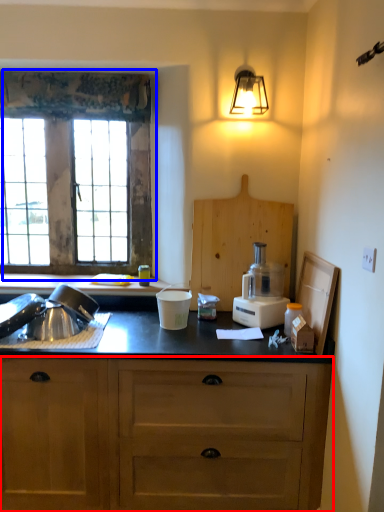
Question: Which object appears farthest to the camera in this image, cabinetry (highlighted by a red box) or window (highlighted by a blue box)?

Choices:
 (A) cabinetry
 (B) window

Answer: (B)